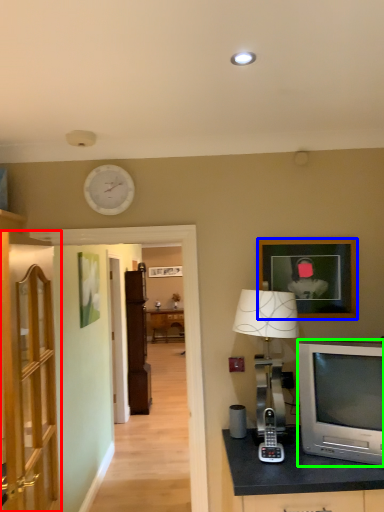
Question: Which object is the closest to the cabinetry (highlighted by a red box)? Choose among these: picture frame (highlighted by a blue box) or television (highlighted by a green box).

Choices:
 (A) picture frame
 (B) television

Answer: (B)